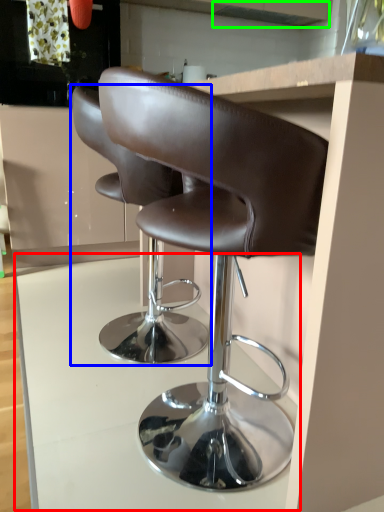
Question: Considering the real-world distances, which object is closest to table (highlighted by a red box)? chair (highlighted by a blue box) or exhaust hood (highlighted by a green box).

Choices:
 (A) chair
 (B) exhaust hood

Answer: (A)